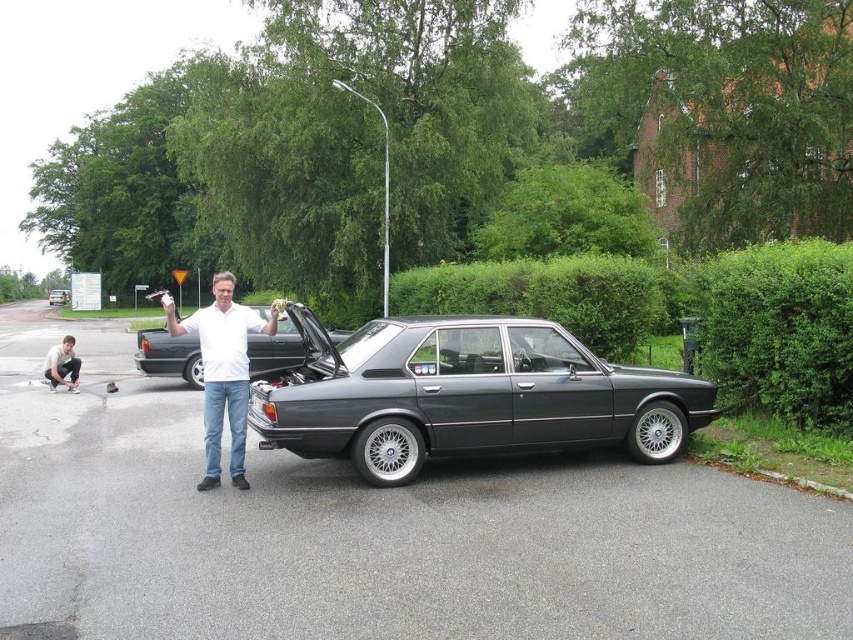
Question: Which point is farther to the camera?

Choices:
 (A) (310, 314)
 (B) (251, 333)
 (C) (57, 296)

Answer: (C)

Question: Is metallic gray sedan at center positioned behind white matte shirt at center?

Choices:
 (A) yes
 (B) no

Answer: (A)

Question: Among these points, which one is farthest from the camera?

Choices:
 (A) (154, 328)
 (B) (395, 449)

Answer: (A)

Question: Does satin black sedan at center have a larger size compared to matte white shirt at center?

Choices:
 (A) no
 (B) yes

Answer: (B)

Question: Does white matte shirt at center appear on the left side of metallic silver sedan at center?

Choices:
 (A) yes
 (B) no

Answer: (B)

Question: Which of the following is the closest to the observer?

Choices:
 (A) metallic gray sedan at center
 (B) satin black sedan at center
 (C) white matte shirt at center

Answer: (C)